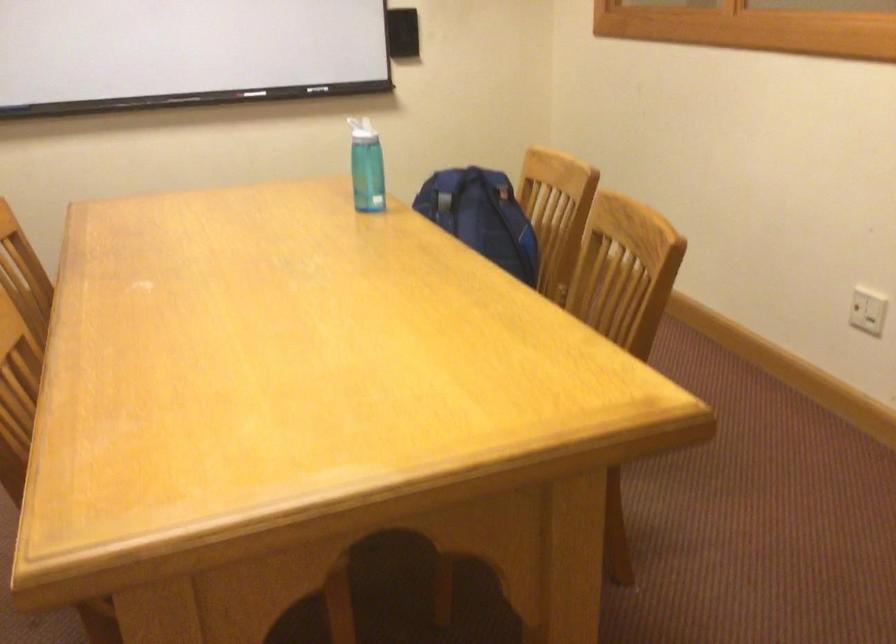
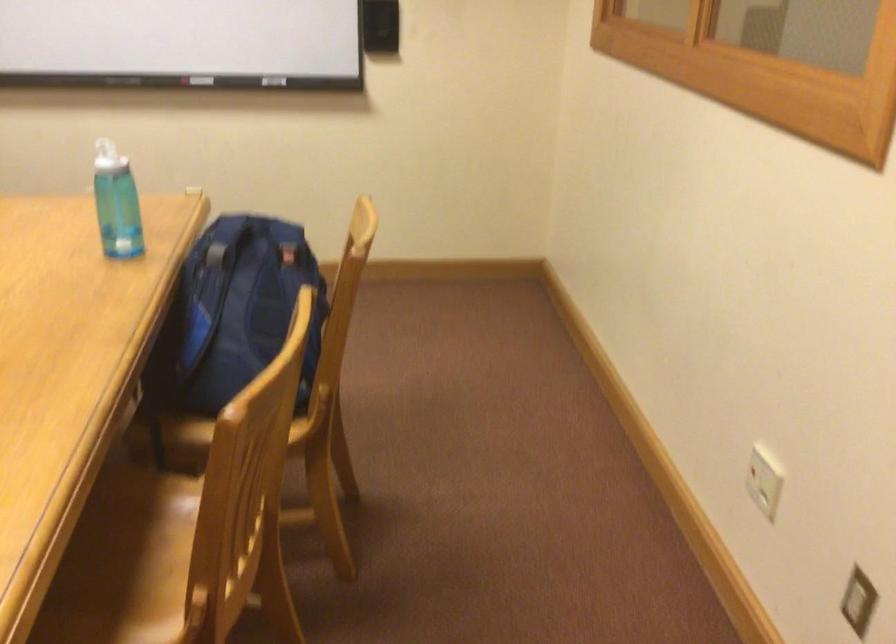
The point at (455, 176) is marked in the first image. Where is the corresponding point in the second image?

(254, 225)